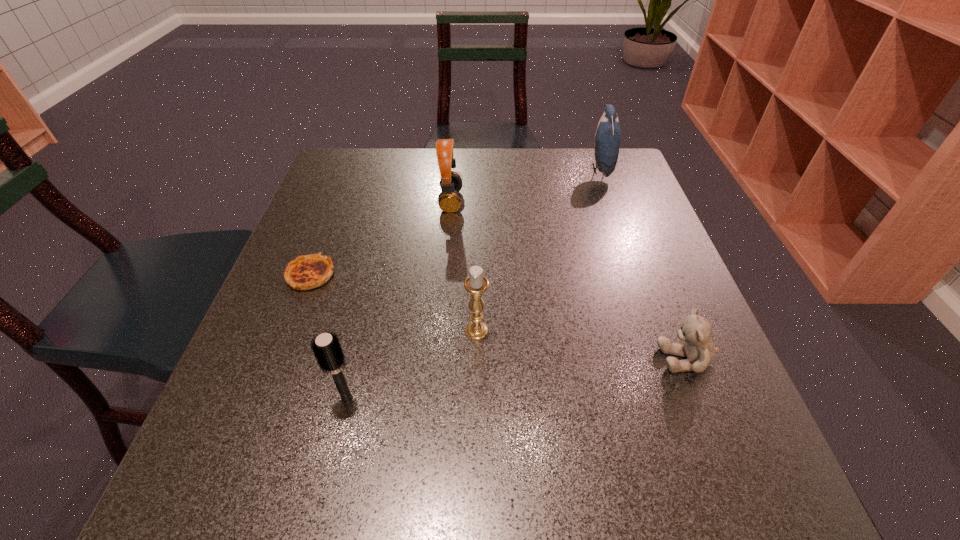
Identify the location of blank space located at the tip of the bird's beak. (556, 169).

The image size is (960, 540). Identify the location of free space located at the tip of the bird's beak. (523, 169).

Locate an element on the screen. The height and width of the screenshot is (540, 960). free point located on the ear cups of the headset is located at coordinates (542, 201).

Identify the location of vacant position located on the left of the third object from right to left. (363, 330).

I want to click on vacant space located 0.310m on the right of the hairbrush, so click(x=549, y=399).

The width and height of the screenshot is (960, 540). I want to click on vacant space located 0.190m on the face of the fifth tallest object, so click(550, 358).

Identify the location of vacant point located 0.190m on the face of the fifth tallest object. The height and width of the screenshot is (540, 960). (550, 358).

Locate an element on the screen. free space located 0.260m on the face of the fifth tallest object is located at coordinates (510, 358).

Identify the location of vacant space situated 0.070m on the front of the fourth nearest object. Image resolution: width=960 pixels, height=540 pixels. (294, 319).

Where is `bird present at the far edge`? This screenshot has height=540, width=960. bird present at the far edge is located at coordinates (608, 134).